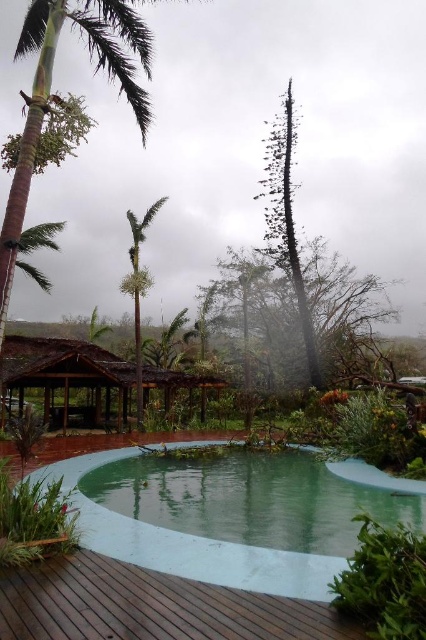
Who is positioned more to the right, green concrete pool at center or green leafy palm tree at center?

green concrete pool at center

Who is more distant from viewer, (264, 586) or (138, 237)?

Point (138, 237)

The image size is (426, 640). Identify the location of green concrete pool at center. (204, 556).

Which of these two, dark green textured tree at center or green leafy palm tree at center, stands taller?

dark green textured tree at center

Does dark green textured tree at center lie in front of green leafy palm tree at center?

No, dark green textured tree at center is behind green leafy palm tree at center.

Find the location of a particular element. Image resolution: width=426 pixels, height=640 pixels. dark green textured tree at center is located at coordinates (285, 220).

What are the coordinates of `dark green textured tree at center` in the screenshot? It's located at (285, 220).

Who is more forward, (52, 392) or (282, 259)?

Point (282, 259) is more forward.

Is brown thatched hut at center to the left of dark green textured tree at center from the viewer's perspective?

Indeed, brown thatched hut at center is positioned on the left side of dark green textured tree at center.

In order to click on brown thatched hut at center in this screenshot , I will do `click(68, 378)`.